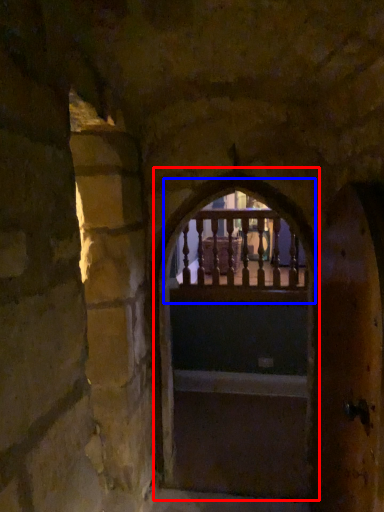
Question: Which object appears farthest to the camera in this image, archway (highlighted by a red box) or window (highlighted by a blue box)?

Choices:
 (A) archway
 (B) window

Answer: (B)